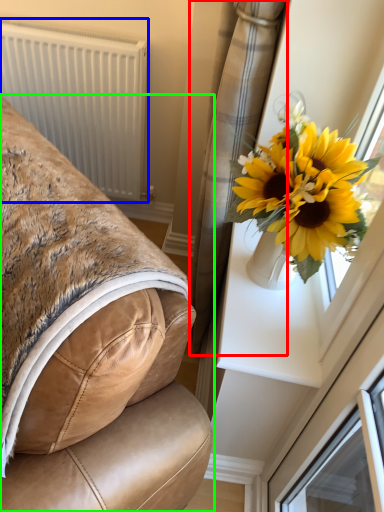
Question: Which is farther away from curtain (highlighted by a red box)? radiator (highlighted by a blue box) or furniture (highlighted by a green box)?

Choices:
 (A) radiator
 (B) furniture

Answer: (A)